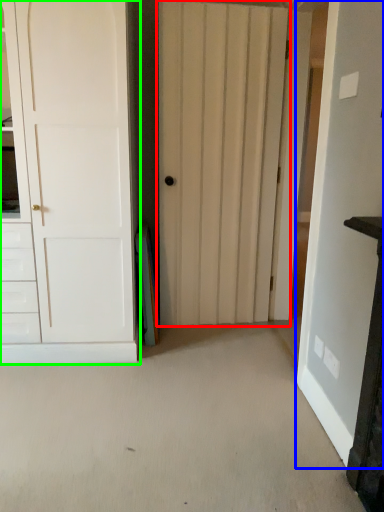
Question: Which object is the farthest from door (highlighted by a red box)? Choose among these: door (highlighted by a blue box) or door (highlighted by a green box).

Choices:
 (A) door
 (B) door

Answer: (A)